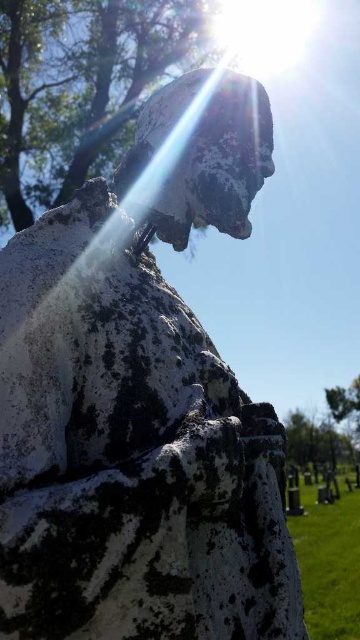
You are standing in a cemetery and see the weathered stone statue and the green leafy tree at upper center. If you want to take a photo of the statue without the tree in the frame, which direction should you move? The statue is in the center of the image.

Move away from the green leafy tree at upper center because it is 3.47 meters away from you, so moving away would reduce the likelihood of the tree appearing in the photo frame.

You are standing in front of the weathered stone statue in the cemetery. You want to take a photo of the statue without any obstructions. Is there a tree blocking the view from your current position? Please answer based on the 2D coordinates of the green leafy tree at upper center.

The green leafy tree at upper center is located at coordinates (79, 84), which is at the upper center of the image. Since you are standing in front of the statue, the tree is positioned above and centered, so it might not block the direct view of the statue unless the camera angle includes the upper part of the scene. However, since the question specifies avoiding obstructions, the tree could be in the frame but not necessarily blocking the statue itself. To ensure no obstruction, you could adjust the v

Looking at this image, you are standing in a cemetery and see the green leafy tree at upper center and the green leafy tree at center. Which tree is bigger?

The green leafy tree at upper center is larger than the green leafy tree at center.